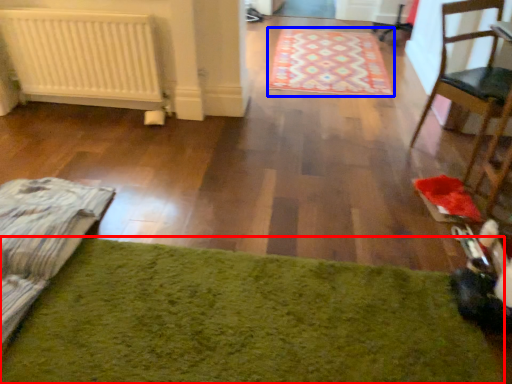
Question: Among these objects, which one is nearest to the camera, mat (highlighted by a red box) or mat (highlighted by a blue box)?

Choices:
 (A) mat
 (B) mat

Answer: (A)